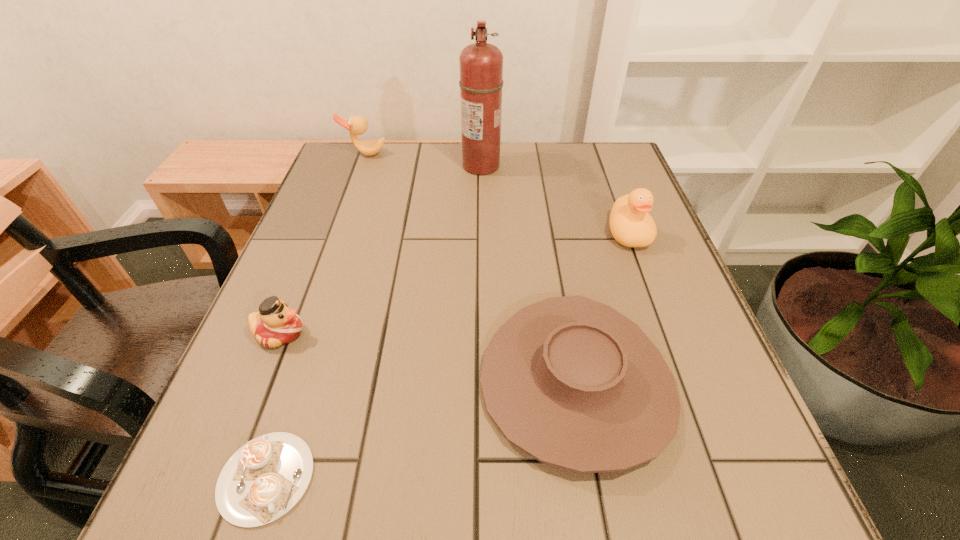
Locate an element on the screen. fire extinguisher is located at coordinates (481, 64).

This screenshot has height=540, width=960. In order to click on the fourth nearest object in this screenshot , I will do `click(631, 225)`.

Locate an element on the screen. This screenshot has width=960, height=540. the second farthest duck is located at coordinates (631, 225).

Image resolution: width=960 pixels, height=540 pixels. What are the coordinates of `the farthest duck` in the screenshot? It's located at (357, 125).

At what (x,y) coordinates should I click in order to perform the action: click on the shortest duck. Please return your answer as a coordinate pair (x, y). Looking at the image, I should click on (276, 324).

Locate an element on the screen. This screenshot has height=540, width=960. cowboy hat is located at coordinates (572, 382).

Image resolution: width=960 pixels, height=540 pixels. In order to click on cappuccino in this screenshot , I will do click(266, 477).

The image size is (960, 540). In order to click on free space located 0.220m on the front-facing side of the tallest object in this screenshot , I will do `click(382, 166)`.

You are a GUI agent. You are given a task and a screenshot of the screen. Output one action in this format:
    pyautogui.click(x=<x>, y=<y>)
    Task: Click on the vacant position located on the front-facing side of the tallest object
    The image size is (960, 540).
    Given the screenshot: What is the action you would take?
    pyautogui.click(x=360, y=166)

This screenshot has width=960, height=540. In order to click on vacant space situated on the front-facing side of the tallest object in this screenshot , I will do `click(419, 166)`.